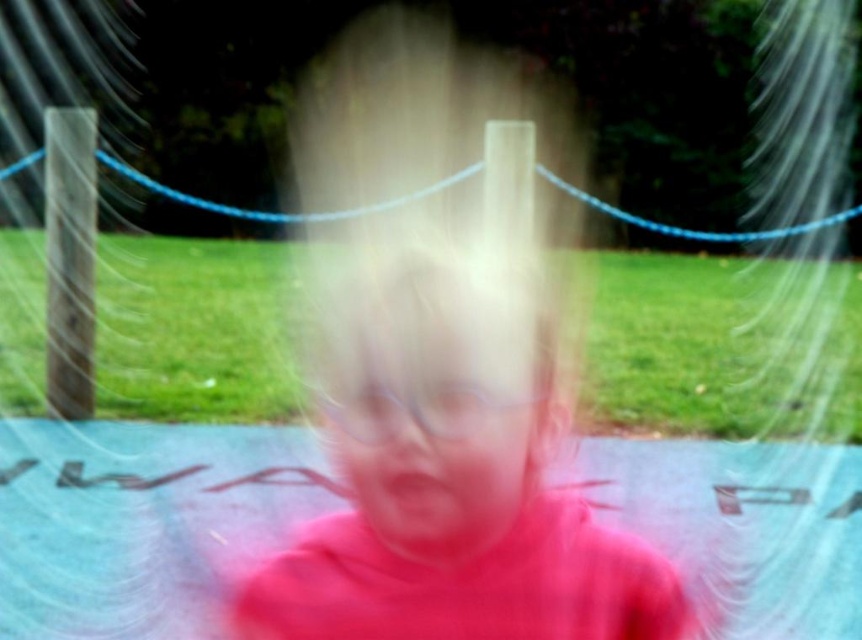
Is pink matte shirt at center below pink matte face at center?

Actually, pink matte shirt at center is above pink matte face at center.

Does pink matte shirt at center appear on the right side of pink matte face at center?

Incorrect, pink matte shirt at center is not on the right side of pink matte face at center.

Is point (373, 545) positioned behind point (345, 403)?

Yes, point (373, 545) is behind point (345, 403).

The image size is (862, 640). Find the location of `pink matte shirt at center`. pink matte shirt at center is located at coordinates (453, 445).